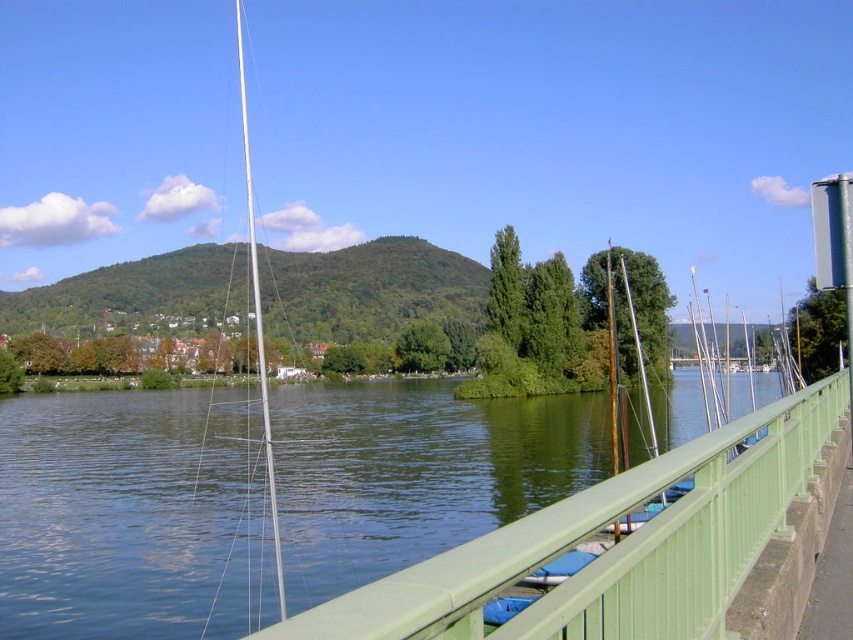
Question: Which point is closer to the camera?

Choices:
 (A) (250, 227)
 (B) (405, 602)

Answer: (B)

Question: Which point is closer to the camera?

Choices:
 (A) (688, 556)
 (B) (262, 371)

Answer: (A)

Question: Can you confirm if green painted metal railing at center is positioned to the right of silver/metallic mast at center-left?

Choices:
 (A) yes
 (B) no

Answer: (A)

Question: Is green painted metal railing at center closer to the viewer compared to silver/metallic mast at center-left?

Choices:
 (A) yes
 (B) no

Answer: (A)

Question: Can you confirm if green painted metal railing at center is positioned below silver/metallic mast at center-left?

Choices:
 (A) yes
 (B) no

Answer: (A)